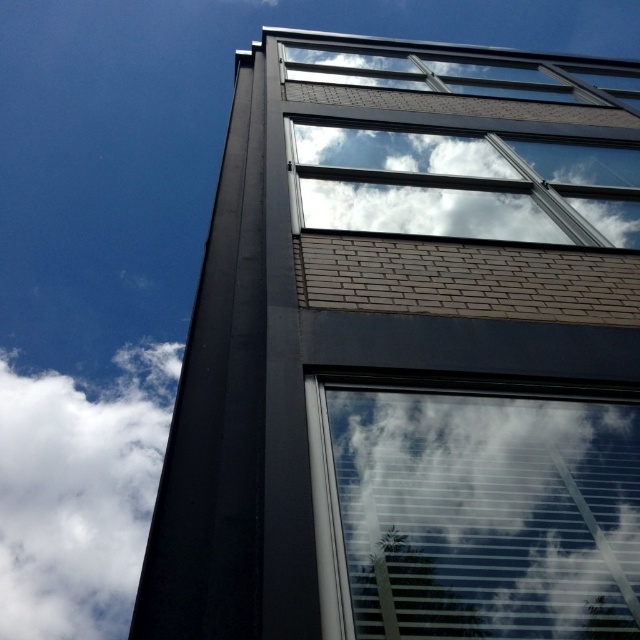
Looking at this image, between transparent glass window at center and white fluffy cloud at upper left, which one appears on the right side from the viewer's perspective?

transparent glass window at center is more to the right.

Is transparent glass window at center wider than white fluffy cloud at upper left?

No, transparent glass window at center is not wider than white fluffy cloud at upper left.

Does point (493, 522) come farther from viewer compared to point (88, 538)?

That is False.

At what (x,y) coordinates should I click in order to perform the action: click on transparent glass window at center. Please return your answer as a coordinate pair (x, y). This screenshot has height=640, width=640. Looking at the image, I should click on (474, 513).

Is transparent glass window at center to the right of white cloud at upper center from the viewer's perspective?

No, transparent glass window at center is not to the right of white cloud at upper center.

Can you confirm if transparent glass window at center is positioned above white cloud at upper center?

Incorrect, transparent glass window at center is not positioned above white cloud at upper center.

Does point (506, 561) come behind point (634, 189)?

No, it is in front of (634, 189).

At what (x,y) coordinates should I click in order to perform the action: click on transparent glass window at center. Please return your answer as a coordinate pair (x, y). Looking at the image, I should click on (474, 513).

Does white fluffy cloud at upper left have a lesser height compared to white cloud at upper center?

Incorrect, white fluffy cloud at upper left's height does not fall short of white cloud at upper center's.

Describe the element at coordinates (77, 492) in the screenshot. I see `white fluffy cloud at upper left` at that location.

Between point (97, 513) and point (301, 164), which one is positioned behind?

Point (97, 513)

Locate an element on the screen. Image resolution: width=640 pixels, height=640 pixels. white fluffy cloud at upper left is located at coordinates (77, 492).